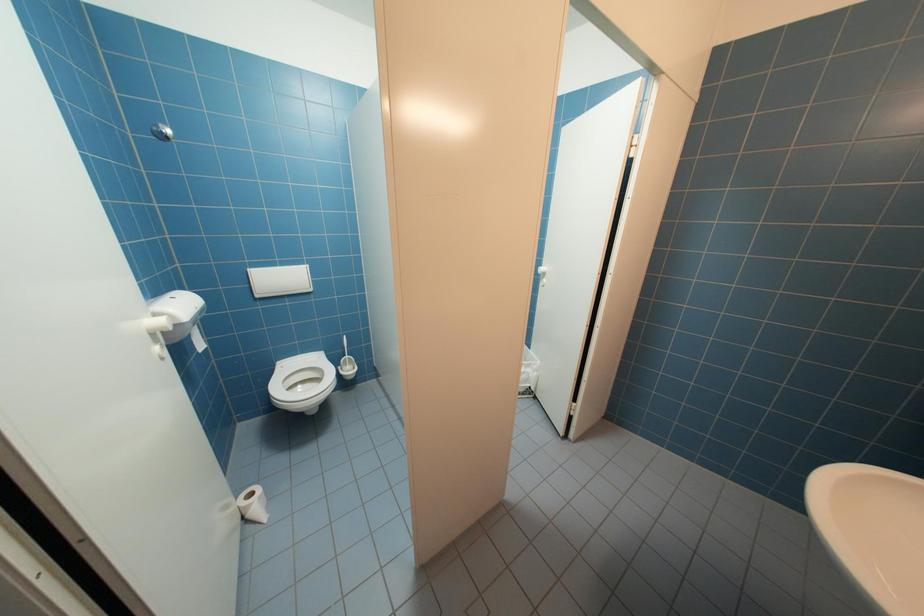
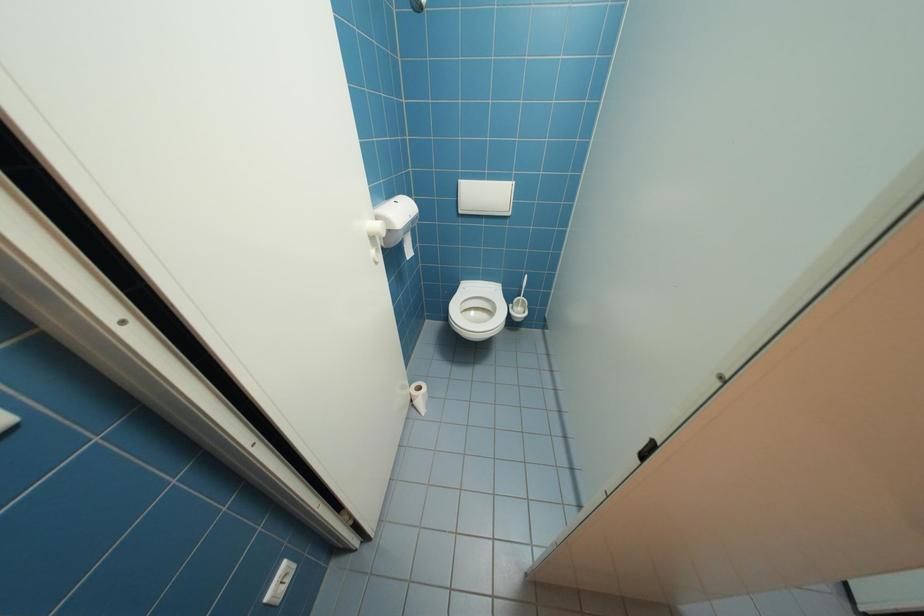
Based on the continuous images, in which direction is the camera rotating?

The rotation direction of the camera is left-down.